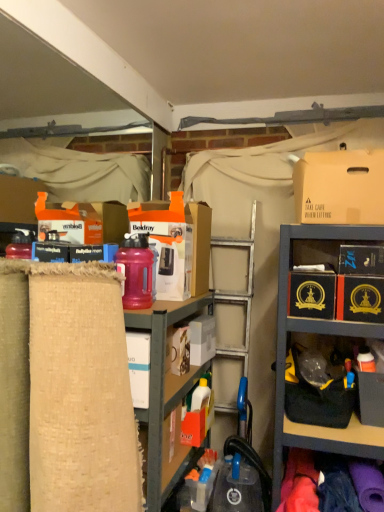
Question: Can you confirm if black cardboard box at right, acting as the fifth storage box starting from the left, is shorter than white cardboard box at center, marked as the 1th storage box in a left-to-right arrangement?

Choices:
 (A) no
 (B) yes

Answer: (B)

Question: Would you consider black cardboard box at right, acting as the fifth storage box starting from the left, to be distant from white cardboard box at center, marked as the 1th storage box in a left-to-right arrangement?

Choices:
 (A) yes
 (B) no

Answer: (B)

Question: Considering the relative positions of black cardboard box at right, acting as the fifth storage box starting from the left, and white cardboard box at center, marked as the 1th storage box in a left-to-right arrangement, in the image provided, is black cardboard box at right, acting as the fifth storage box starting from the left, behind white cardboard box at center, marked as the 1th storage box in a left-to-right arrangement,?

Choices:
 (A) yes
 (B) no

Answer: (B)

Question: Is black cardboard box at right, acting as the fifth storage box starting from the left, positioned beyond the bounds of white cardboard box at center, marked as the 5th storage box in a right-to-left arrangement?

Choices:
 (A) no
 (B) yes

Answer: (B)

Question: From a real-world perspective, is black cardboard box at right, the first storage box in the right-to-left sequence, below white cardboard box at center, marked as the 5th storage box in a right-to-left arrangement?

Choices:
 (A) no
 (B) yes

Answer: (B)

Question: Can you confirm if black cardboard box at right, the first storage box in the right-to-left sequence, is positioned to the left of white cardboard box at center, marked as the 5th storage box in a right-to-left arrangement?

Choices:
 (A) no
 (B) yes

Answer: (A)

Question: Is white cardboard box at center, marked as the 4th storage box in a right-to-left arrangement, at the left side of brown cardboard box at upper right?

Choices:
 (A) yes
 (B) no

Answer: (A)

Question: Is white cardboard box at center, marked as the 4th storage box in a right-to-left arrangement, not within brown cardboard box at upper right?

Choices:
 (A) yes
 (B) no

Answer: (A)

Question: Is white cardboard box at center, marked as the 4th storage box in a right-to-left arrangement, smaller than brown cardboard box at upper right?

Choices:
 (A) no
 (B) yes

Answer: (B)

Question: From a real-world perspective, does white cardboard box at center, the 2th storage box from the left, sit lower than brown cardboard box at upper right?

Choices:
 (A) no
 (B) yes

Answer: (B)

Question: Does white cardboard box at center, marked as the 4th storage box in a right-to-left arrangement, come in front of brown cardboard box at upper right?

Choices:
 (A) yes
 (B) no

Answer: (B)

Question: Would you consider white cardboard box at center, the 2th storage box from the left, to be distant from brown cardboard box at upper right?

Choices:
 (A) yes
 (B) no

Answer: (B)

Question: Considering the relative sizes of black cardboard box at center-right, which is the third storage box in left-to-right order, and black cardboard box at upper right, arranged as the second storage box when viewed from the right, in the image provided, is black cardboard box at center-right, which is the third storage box in left-to-right order, shorter than black cardboard box at upper right, arranged as the second storage box when viewed from the right,?

Choices:
 (A) yes
 (B) no

Answer: (B)